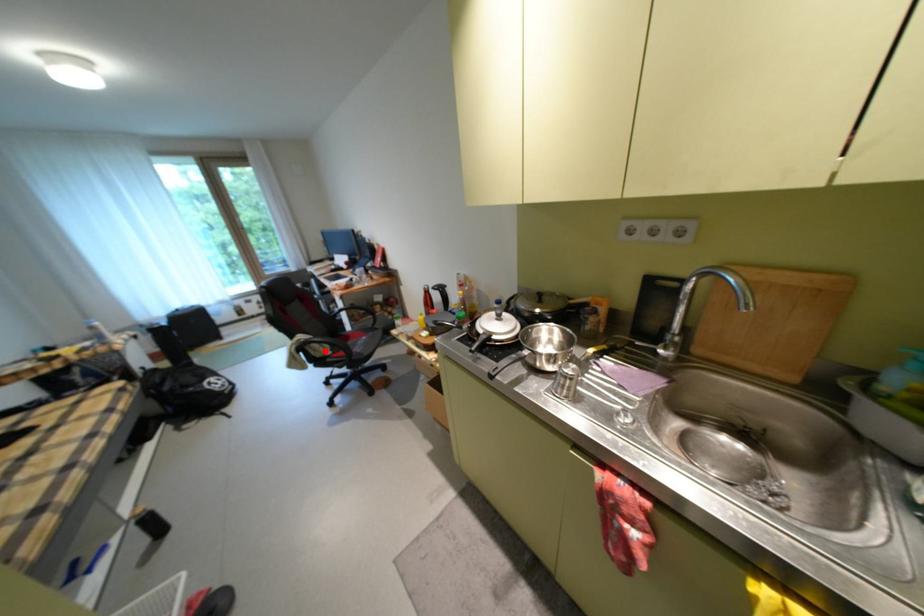
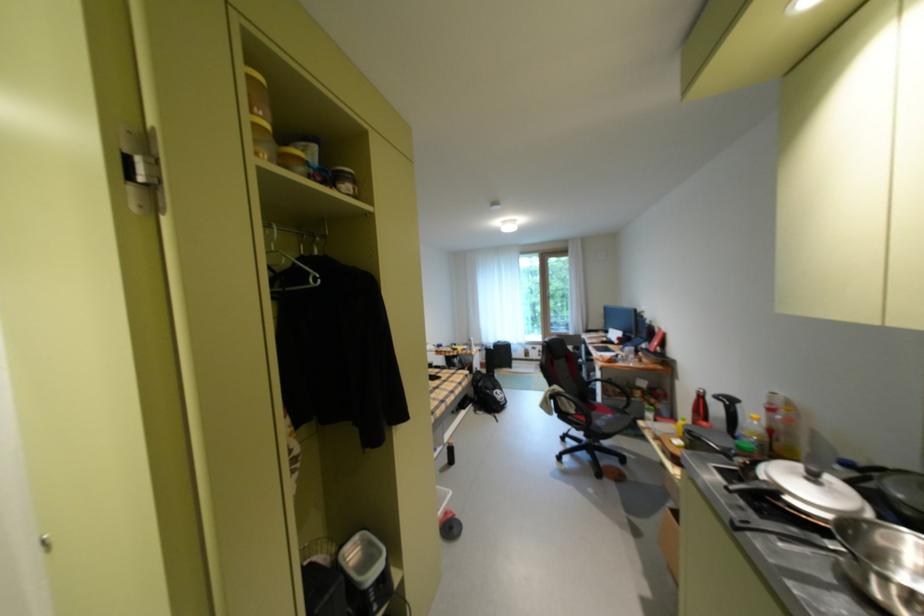
Question: I am providing you with two images of the same scene from different viewpoints. In image1, a red point is highlighted. Considering the same 3D point in image2, which of the following is correct?

Choices:
 (A) It is closer
 (B) It is farther

Answer: (B)